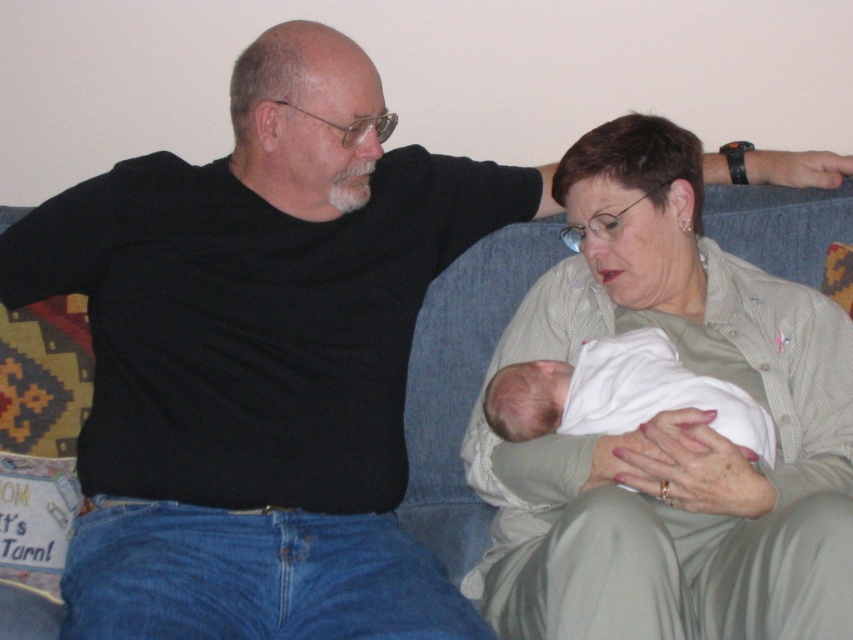
Question: Does light green textured shirt at center have a smaller size compared to white soft cloth at center?

Choices:
 (A) no
 (B) yes

Answer: (A)

Question: Which object appears farthest from the camera in this image?

Choices:
 (A) light green textured shirt at center
 (B) white soft cloth at center

Answer: (B)

Question: Is light green textured shirt at center positioned behind white soft cloth at center?

Choices:
 (A) no
 (B) yes

Answer: (A)

Question: Is light green textured shirt at center smaller than white soft cloth at center?

Choices:
 (A) no
 (B) yes

Answer: (A)

Question: Among these objects, which one is nearest to the camera?

Choices:
 (A) white soft cloth at center
 (B) light green textured shirt at center

Answer: (B)